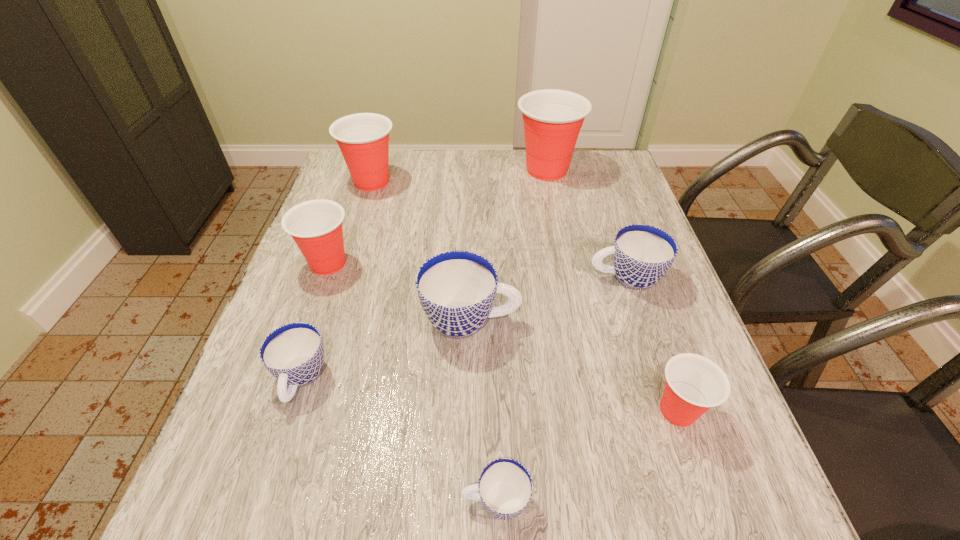
Find the location of `free space located on the side of the second shortest object with the handle`. free space located on the side of the second shortest object with the handle is located at coordinates (250, 535).

Where is `vacant region located 0.260m on the side of the smallest blue cup with the handle`? vacant region located 0.260m on the side of the smallest blue cup with the handle is located at coordinates (299, 501).

Where is `vacant space located on the side of the smallest blue cup with the handle`? vacant space located on the side of the smallest blue cup with the handle is located at coordinates (274, 501).

You are a GUI agent. You are given a task and a screenshot of the screen. Output one action in this format:
    pyautogui.click(x=<x>, y=<y>)
    Task: Click on the blank space located on the side of the smallest blue cup with the handle
    The height and width of the screenshot is (540, 960).
    Given the screenshot: What is the action you would take?
    pyautogui.click(x=311, y=501)

Locate an element on the screen. This screenshot has height=540, width=960. object that is positioned at the near edge is located at coordinates (505, 486).

At what (x,y) coordinates should I click in order to perform the action: click on object positioned at the far left corner. Please return your answer as a coordinate pair (x, y). Looking at the image, I should click on (363, 138).

Locate an element on the screen. The height and width of the screenshot is (540, 960). object located at the far right corner is located at coordinates (552, 118).

In the image, there is a desktop. Find the location of `vacant space at the near edge`. vacant space at the near edge is located at coordinates (355, 499).

Image resolution: width=960 pixels, height=540 pixels. Find the location of `vacant area at the left edge`. vacant area at the left edge is located at coordinates (273, 461).

This screenshot has width=960, height=540. In the image, there is a desktop. In order to click on vacant space at the right edge in this screenshot , I will do (658, 362).